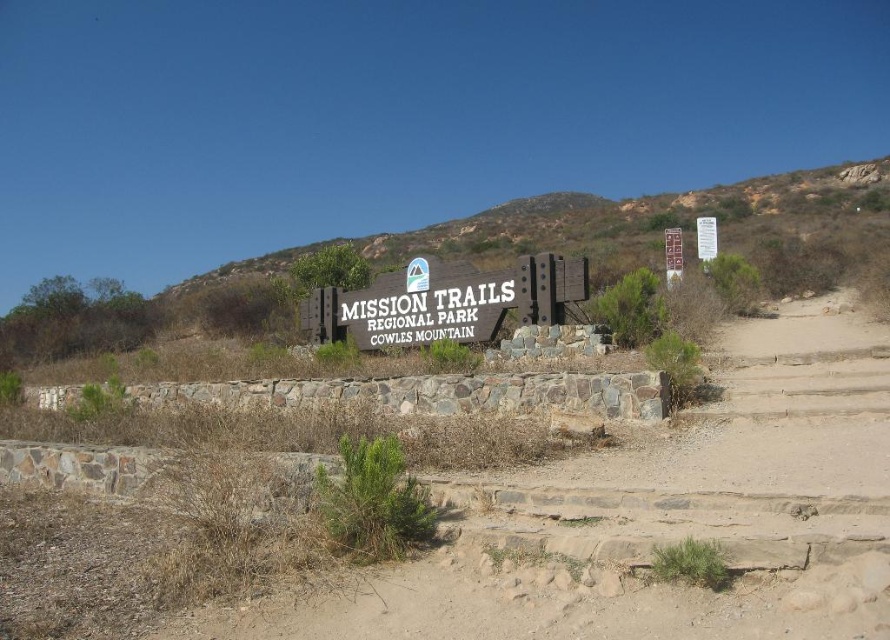
Question: Based on their relative distances, which object is nearer to the wooden sign at upper right?

Choices:
 (A) white paper sign at upper center
 (B) brown stone steps at center

Answer: (A)

Question: Is the position of wooden sign at upper right more distant than that of white paper sign at upper center?

Choices:
 (A) yes
 (B) no

Answer: (B)

Question: Is brown stone steps at center positioned in front of white paper sign at upper center?

Choices:
 (A) no
 (B) yes

Answer: (B)

Question: Is brown stone steps at center further to camera compared to wooden sign at upper right?

Choices:
 (A) yes
 (B) no

Answer: (B)

Question: Estimate the real-world distances between objects in this image. Which object is farther from the brown stone steps at center?

Choices:
 (A) wooden sign at center
 (B) white paper sign at upper center
 (C) wooden sign at upper right

Answer: (B)

Question: Which object appears closest to the camera in this image?

Choices:
 (A) wooden sign at upper right
 (B) brown stone steps at center
 (C) wooden sign at center
 (D) white paper sign at upper center

Answer: (B)